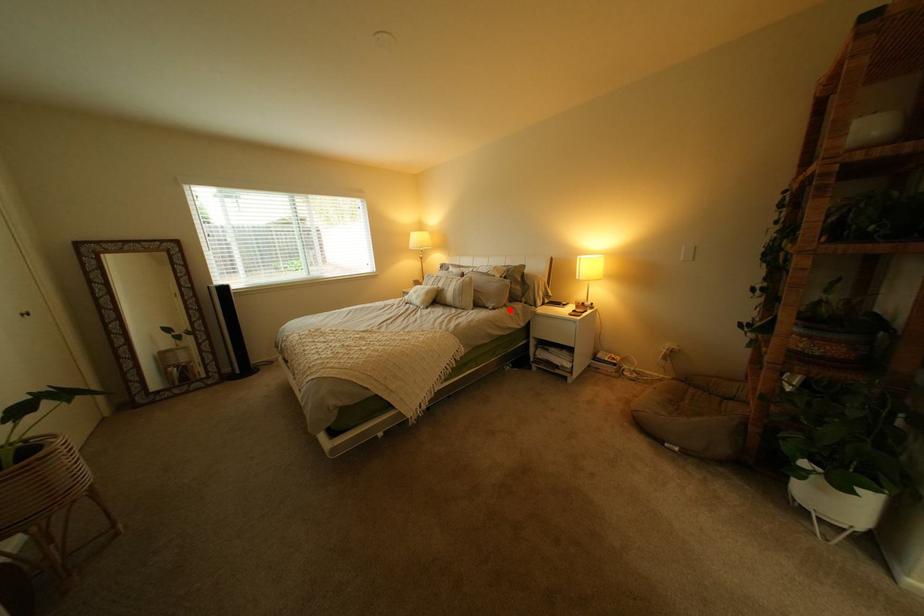
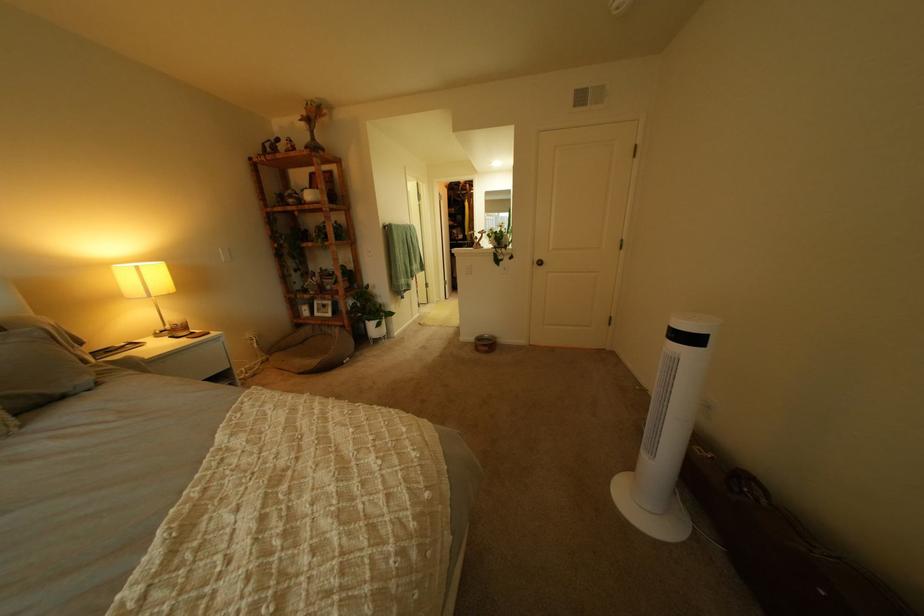
In the second image, find the point that corresponds to the highlighted location in the first image.

(115, 385)